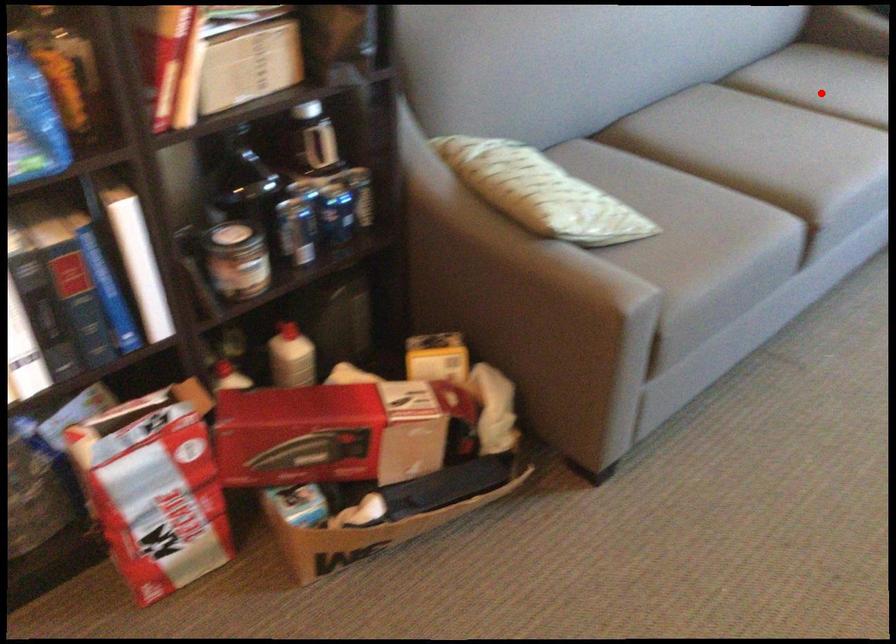
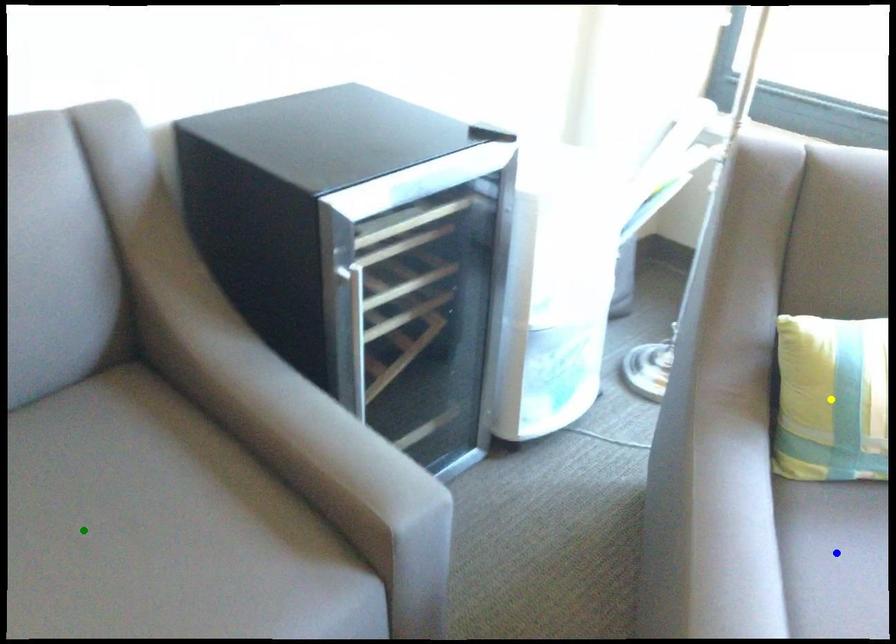
Question: I am providing you with two images of the same scene from different viewpoints. A red point is marked on the first image. You are given multiple points on the second image. Which point in image 2 is actually the same real-world point as the red point in image 1?

Choices:
 (A) yellow point
 (B) green point
 (C) blue point

Answer: (B)